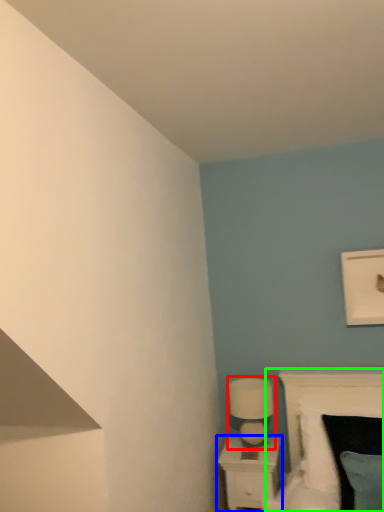
Question: Which object is positioned closest to table lamp (highlighted by a red box)? Select from nightstand (highlighted by a blue box) and bed (highlighted by a green box).

Choices:
 (A) nightstand
 (B) bed

Answer: (A)